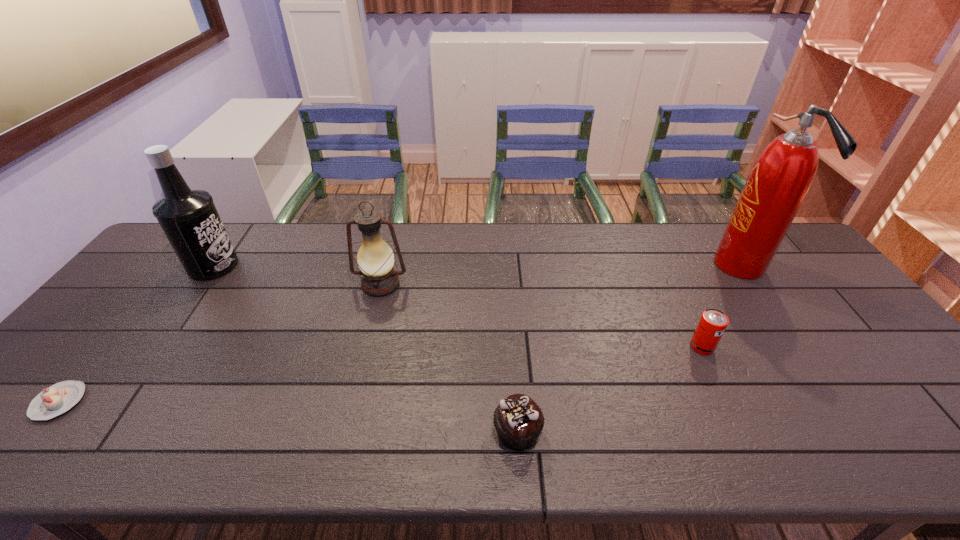
Locate an element on the screen. This screenshot has width=960, height=540. the shortest object is located at coordinates (57, 399).

The image size is (960, 540). I want to click on the left cupcake, so click(x=57, y=399).

Identify the location of blank area located 0.260m on the front of the fire extinguisher. The height and width of the screenshot is (540, 960). (804, 359).

I want to click on free spot located on the front label of the second tallest object, so click(256, 266).

Where is `vacant region located 0.210m on the front of the third object from left to right`? vacant region located 0.210m on the front of the third object from left to right is located at coordinates (362, 359).

At what (x,y) coordinates should I click in order to perform the action: click on free space located on the back of the fourth farthest object. Please return your answer as a coordinate pair (x, y). Looking at the image, I should click on (685, 314).

Locate an element on the screen. The height and width of the screenshot is (540, 960). vacant space located 0.190m on the left of the taller cupcake is located at coordinates (405, 433).

Identify the location of vacant space positioned on the back of the left cupcake. coord(156,285).

Identify the location of fire extinguisher located at the far edge. The image size is (960, 540). (781, 177).

At what (x,y) coordinates should I click in order to perform the action: click on liquor that is positioned at the far edge. Please return your answer as a coordinate pair (x, y). The image size is (960, 540). Looking at the image, I should click on (188, 217).